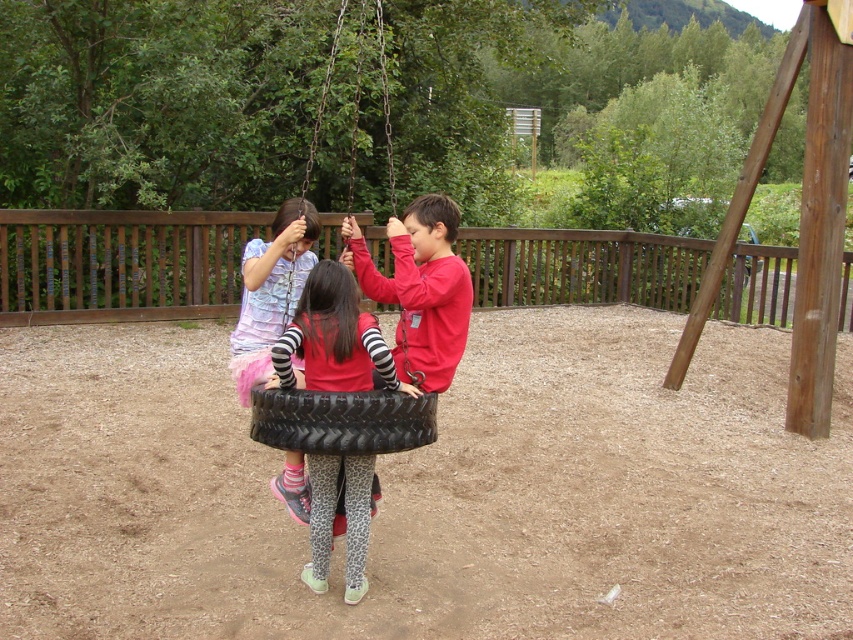
Question: Can you confirm if red matte shirt at center is bigger than striped fabric dress at center?

Choices:
 (A) yes
 (B) no

Answer: (B)

Question: Which of the following is the farthest from the observer?

Choices:
 (A) striped fabric dress at center
 (B) black rubber tire at center

Answer: (A)

Question: Which object appears closest to the camera in this image?

Choices:
 (A) red matte shirt at center
 (B) black rubber tire at center
 (C) striped fabric dress at center

Answer: (A)

Question: Which point is closer to the camera taking this photo?

Choices:
 (A) (254, 305)
 (B) (347, 316)

Answer: (B)

Question: Does striped fabric dress at center appear over black rubber tire at center?

Choices:
 (A) no
 (B) yes

Answer: (B)

Question: Is striped fabric dress at center closer to the viewer compared to black rubber tire at center?

Choices:
 (A) yes
 (B) no

Answer: (B)